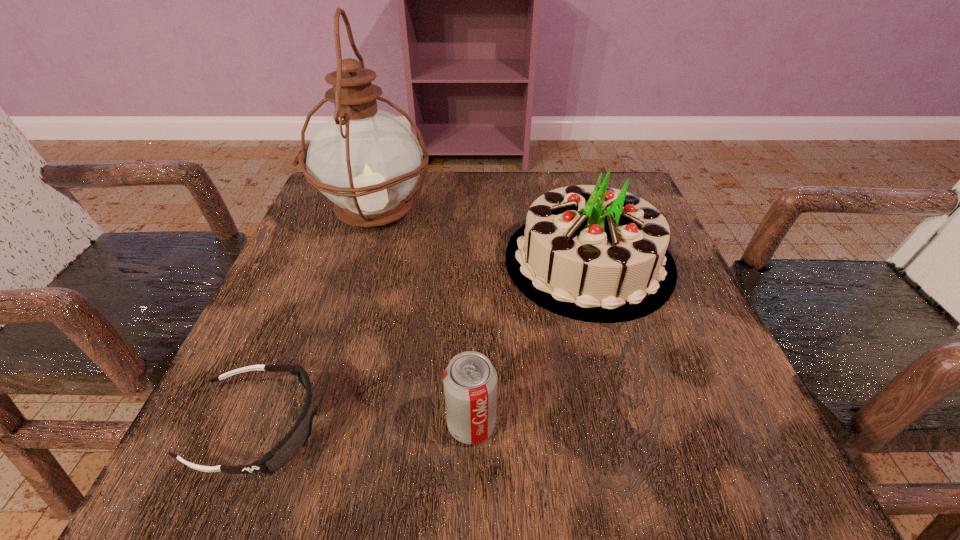
At what (x,y) coordinates should I click in order to perform the action: click on free space at the far edge. Please return your answer as a coordinate pair (x, y). Looking at the image, I should click on (452, 198).

The image size is (960, 540). Identify the location of vacant space at the near edge of the desktop. (404, 455).

The image size is (960, 540). I want to click on free space at the left edge of the desktop, so click(317, 401).

In the image, there is a desktop. Where is `free space at the far left corner`? This screenshot has width=960, height=540. free space at the far left corner is located at coordinates (337, 220).

Where is `vacant space at the far right corner of the desktop`? This screenshot has width=960, height=540. vacant space at the far right corner of the desktop is located at coordinates (623, 178).

The width and height of the screenshot is (960, 540). Find the location of `vacant area between the shortest object and the second tallest object`. vacant area between the shortest object and the second tallest object is located at coordinates (424, 345).

You are a GUI agent. You are given a task and a screenshot of the screen. Output one action in this format:
    pyautogui.click(x=<x>, y=<y>)
    Task: Click on the empty space between the oil lamp and the birthday cake
    This screenshot has width=960, height=540.
    Given the screenshot: What is the action you would take?
    pyautogui.click(x=481, y=237)

The image size is (960, 540). I want to click on unoccupied position between the soda can and the oil lamp, so click(422, 318).

Identify the location of empty location between the third tallest object and the third shortest object. The width and height of the screenshot is (960, 540). (530, 343).

In order to click on vacant region between the second object from right to left and the oil lamp in this screenshot , I will do `click(422, 318)`.